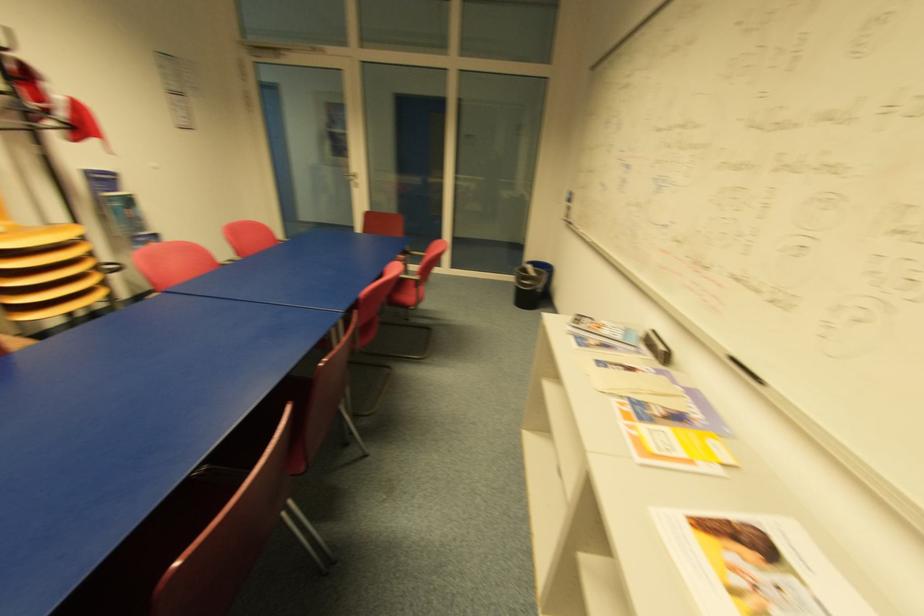
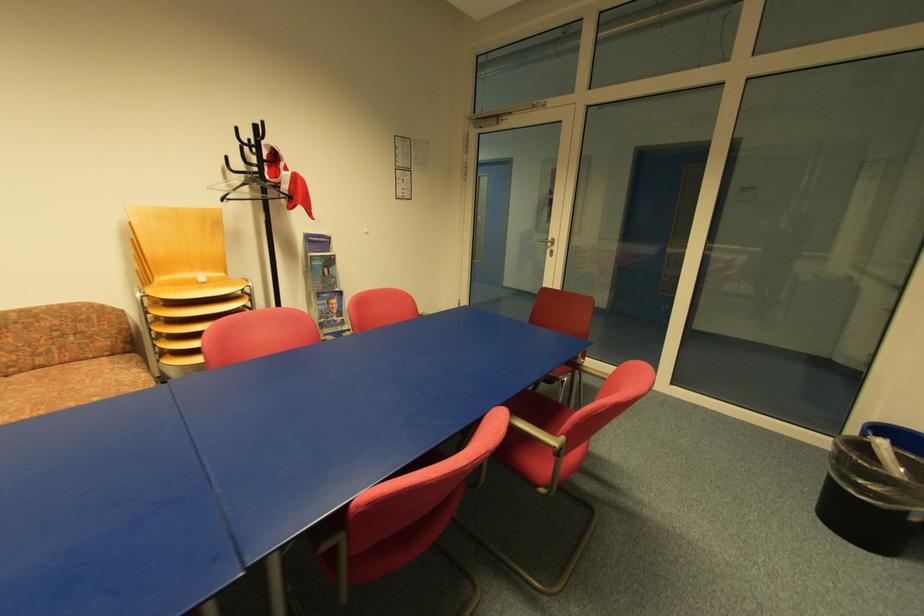
Where in the second image is the point corresponding to (x=539, y=270) from the first image?

(906, 459)